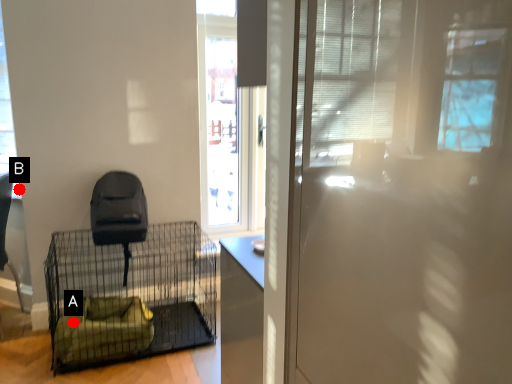
Question: Two points are circled on the image, labeled by A and B beside each circle. Which point appears farthest from the camera in this image?

Choices:
 (A) A is further
 (B) B is further

Answer: (B)